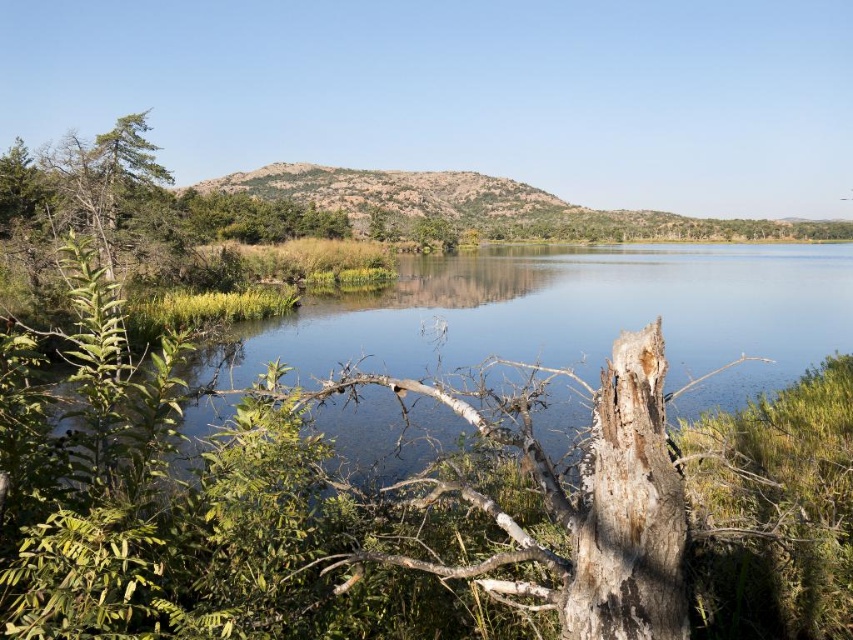
You are standing at the edge of the water and see the clear water at center and the dark brown rough tree trunk at center. Which object is closer to your right side?

The clear water at center is to the right of the dark brown rough tree trunk at center, so the clear water at center is closer to your right side.

You are standing at the edge of the water and want to reach the dark brown rough tree trunk at center. Which direction should you move to get closer to it without crossing the clear water at center?

The dark brown rough tree trunk at center is behind the clear water at center, so you should move forward towards the clear water at center to reach it without crossing the water.

You are standing at the edge of the water and want to take a photo of both the clear water at center and the dark brown rough tree trunk at center. Which object will appear closer to the top of your camera viewfinder?

The clear water at center will appear closer to the top of your camera viewfinder because it is much taller than the dark brown rough tree trunk at center.